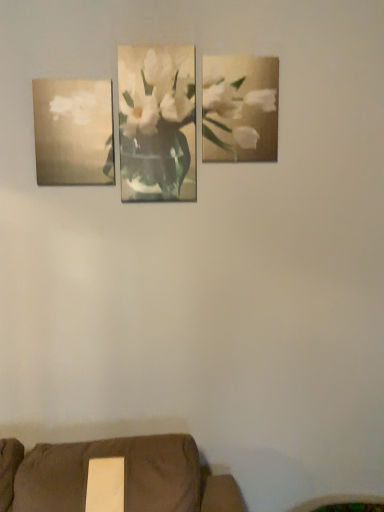
I want to click on matte gold painting at left, the second picture frame when ordered from right to left, so click(x=74, y=132).

The image size is (384, 512). Identify the location of white matte flower at center. (156, 92).

Image resolution: width=384 pixels, height=512 pixels. What do you see at coordinates (240, 108) in the screenshot?
I see `metallic gold painting at upper right, the 2th picture frame when ordered from left to right` at bounding box center [240, 108].

At what (x,y) coordinates should I click in order to perform the action: click on matte gold painting at left, the 1th picture frame viewed from the left. Please return your answer as a coordinate pair (x, y). Image resolution: width=384 pixels, height=512 pixels. Looking at the image, I should click on (74, 132).

Which of these two, white matte flower at center or metallic gold painting at upper right, the 2th picture frame when ordered from left to right, stands taller?

white matte flower at center.

From the image's perspective, is white matte flower at center under metallic gold painting at upper right, the 2th picture frame when ordered from left to right?

Yes.

From a real-world perspective, relative to metallic gold painting at upper right, the 2th picture frame when ordered from left to right, is white matte flower at center vertically above or below?

white matte flower at center is situated lower than metallic gold painting at upper right, the 2th picture frame when ordered from left to right, in the real world.

Is metallic gold painting at upper right, the 2th picture frame when ordered from left to right, at the back of matte gold painting at left, the second picture frame when ordered from right to left?

No, metallic gold painting at upper right, the 2th picture frame when ordered from left to right, is not at the back of matte gold painting at left, the second picture frame when ordered from right to left.

In the image, is matte gold painting at left, the second picture frame when ordered from right to left, positioned in front of or behind metallic gold painting at upper right, the first picture frame from the right?

Visually, matte gold painting at left, the second picture frame when ordered from right to left, is located in front of metallic gold painting at upper right, the first picture frame from the right.

Consider the image. Is matte gold painting at left, the 1th picture frame viewed from the left, bigger than metallic gold painting at upper right, the 2th picture frame when ordered from left to right?

Yes, matte gold painting at left, the 1th picture frame viewed from the left, is bigger than metallic gold painting at upper right, the 2th picture frame when ordered from left to right.

Considering the relative positions of matte gold painting at left, the second picture frame when ordered from right to left, and metallic gold painting at upper right, the first picture frame from the right, in the image provided, is matte gold painting at left, the second picture frame when ordered from right to left, to the left or to the right of metallic gold painting at upper right, the first picture frame from the right,?

matte gold painting at left, the second picture frame when ordered from right to left, is to the left of metallic gold painting at upper right, the first picture frame from the right.

Is white matte flower at center oriented towards matte gold painting at left, the 1th picture frame viewed from the left?

No.

How distant is white matte flower at center from matte gold painting at left, the 1th picture frame viewed from the left?

19.73 centimeters.

Considering the relative sizes of white matte flower at center and matte gold painting at left, the second picture frame when ordered from right to left, in the image provided, is white matte flower at center taller than matte gold painting at left, the second picture frame when ordered from right to left,?

Correct, white matte flower at center is much taller as matte gold painting at left, the second picture frame when ordered from right to left.

Based on their sizes in the image, would you say white matte flower at center is bigger or smaller than matte gold painting at left, the 1th picture frame viewed from the left?

Clearly, white matte flower at center is larger in size than matte gold painting at left, the 1th picture frame viewed from the left.

From a real-world perspective, which is physically above, metallic gold painting at upper right, the 2th picture frame when ordered from left to right, or white matte flower at center?

metallic gold painting at upper right, the 2th picture frame when ordered from left to right.

Is metallic gold painting at upper right, the first picture frame from the right, in contact with white matte flower at center?

They are not placed beside each other.

Does metallic gold painting at upper right, the first picture frame from the right, have a greater width compared to white matte flower at center?

Correct, the width of metallic gold painting at upper right, the first picture frame from the right, exceeds that of white matte flower at center.

Can you tell me how much metallic gold painting at upper right, the first picture frame from the right, and white matte flower at center differ in facing direction?

metallic gold painting at upper right, the first picture frame from the right, and white matte flower at center are facing 0.756 degrees away from each other.

Where is `picture frame located above the matte gold painting at left, the 1th picture frame viewed from the left (from the image's perspective)`? This screenshot has width=384, height=512. picture frame located above the matte gold painting at left, the 1th picture frame viewed from the left (from the image's perspective) is located at coordinates (240, 108).

Is the surface of metallic gold painting at upper right, the first picture frame from the right, in direct contact with matte gold painting at left, the 1th picture frame viewed from the left?

No, metallic gold painting at upper right, the first picture frame from the right, is not making contact with matte gold painting at left, the 1th picture frame viewed from the left.

From a real-world perspective, is metallic gold painting at upper right, the 2th picture frame when ordered from left to right, on matte gold painting at left, the second picture frame when ordered from right to left?

Yes, from a real-world perspective, metallic gold painting at upper right, the 2th picture frame when ordered from left to right, is above matte gold painting at left, the second picture frame when ordered from right to left.

Which is correct: matte gold painting at left, the second picture frame when ordered from right to left, is inside white matte flower at center, or outside of it?

matte gold painting at left, the second picture frame when ordered from right to left, is located beyond the bounds of white matte flower at center.

Looking at this image, from a real-world perspective, is matte gold painting at left, the 1th picture frame viewed from the left, beneath white matte flower at center?

Correct, in the physical world, matte gold painting at left, the 1th picture frame viewed from the left, is lower than white matte flower at center.

Can you confirm if matte gold painting at left, the second picture frame when ordered from right to left, is positioned to the left of white matte flower at center?

Yes.

Identify the location of flower above the matte gold painting at left, the second picture frame when ordered from right to left (from the image's perspective). (156, 92).

Find the location of a particular element. The width and height of the screenshot is (384, 512). flower in front of the metallic gold painting at upper right, the first picture frame from the right is located at coordinates (156, 92).

Locate an element on the screen. This screenshot has height=512, width=384. picture frame on the left of the metallic gold painting at upper right, the 2th picture frame when ordered from left to right is located at coordinates (74, 132).

Based on their spatial positions, is white matte flower at center or matte gold painting at left, the 1th picture frame viewed from the left, further from metallic gold painting at upper right, the 2th picture frame when ordered from left to right?

Based on the image, matte gold painting at left, the 1th picture frame viewed from the left, appears to be further to metallic gold painting at upper right, the 2th picture frame when ordered from left to right.

From the image, which object appears to be nearer to matte gold painting at left, the second picture frame when ordered from right to left, white matte flower at center or metallic gold painting at upper right, the 2th picture frame when ordered from left to right?

white matte flower at center is positioned closer to the anchor matte gold painting at left, the second picture frame when ordered from right to left.

Estimate the real-world distances between objects in this image. Which object is closer to matte gold painting at left, the 1th picture frame viewed from the left, metallic gold painting at upper right, the 2th picture frame when ordered from left to right, or white matte flower at center?

Based on the image, white matte flower at center appears to be nearer to matte gold painting at left, the 1th picture frame viewed from the left.

From the image, which object appears to be nearer to metallic gold painting at upper right, the first picture frame from the right, matte gold painting at left, the second picture frame when ordered from right to left, or white matte flower at center?

The object closer to metallic gold painting at upper right, the first picture frame from the right, is white matte flower at center.

From the image, which object appears to be farther from white matte flower at center, metallic gold painting at upper right, the 2th picture frame when ordered from left to right, or matte gold painting at left, the second picture frame when ordered from right to left?

The object further to white matte flower at center is matte gold painting at left, the second picture frame when ordered from right to left.

From the image, which object appears to be nearer to white matte flower at center, matte gold painting at left, the 1th picture frame viewed from the left, or metallic gold painting at upper right, the 2th picture frame when ordered from left to right?

Based on the image, metallic gold painting at upper right, the 2th picture frame when ordered from left to right, appears to be nearer to white matte flower at center.

Locate an element on the screen. This screenshot has width=384, height=512. flower situated between matte gold painting at left, the 1th picture frame viewed from the left, and metallic gold painting at upper right, the first picture frame from the right, from left to right is located at coordinates (156, 92).